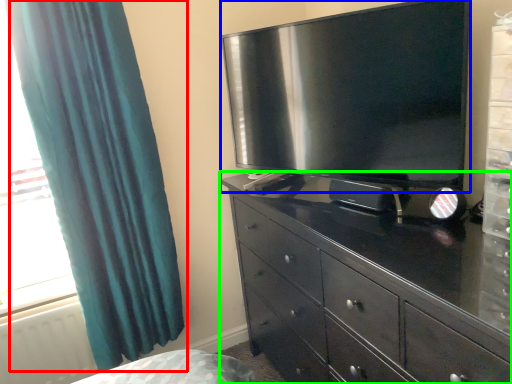
Question: Estimate the real-world distances between objects in this image. Which object is farther from curtain (highlighted by a red box), television (highlighted by a blue box) or chest of drawers (highlighted by a green box)?

Choices:
 (A) television
 (B) chest of drawers

Answer: (B)